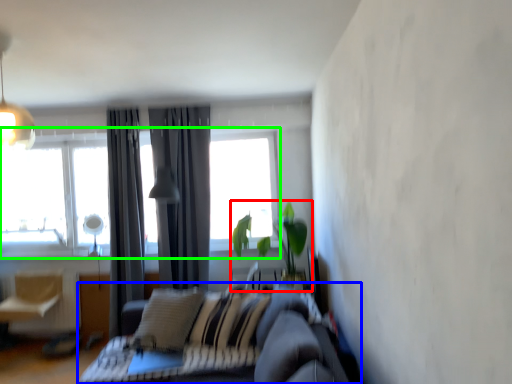
Question: Considering the real-world distances, which object is farthest from houseplant (highlighted by a red box)? studio couch (highlighted by a blue box) or window (highlighted by a green box)?

Choices:
 (A) studio couch
 (B) window

Answer: (B)